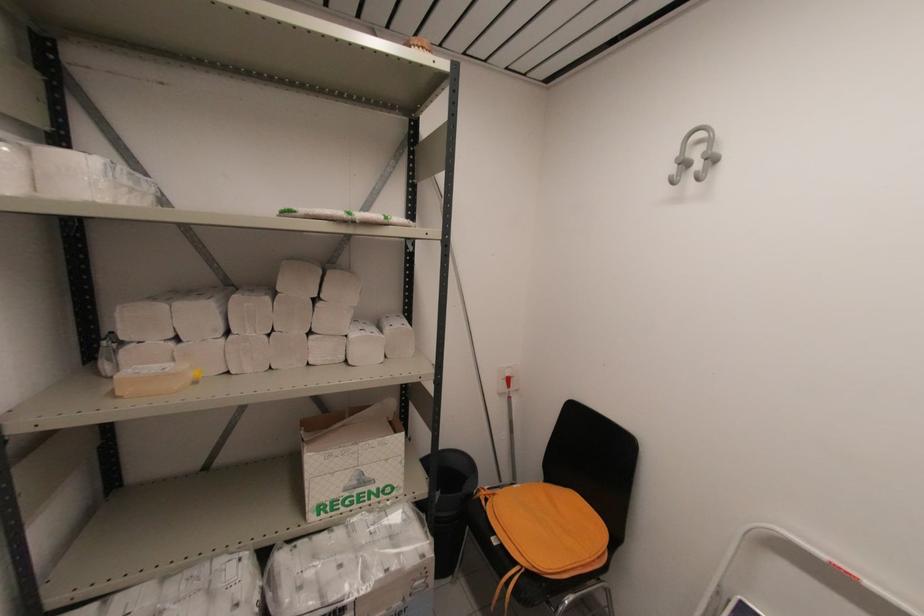
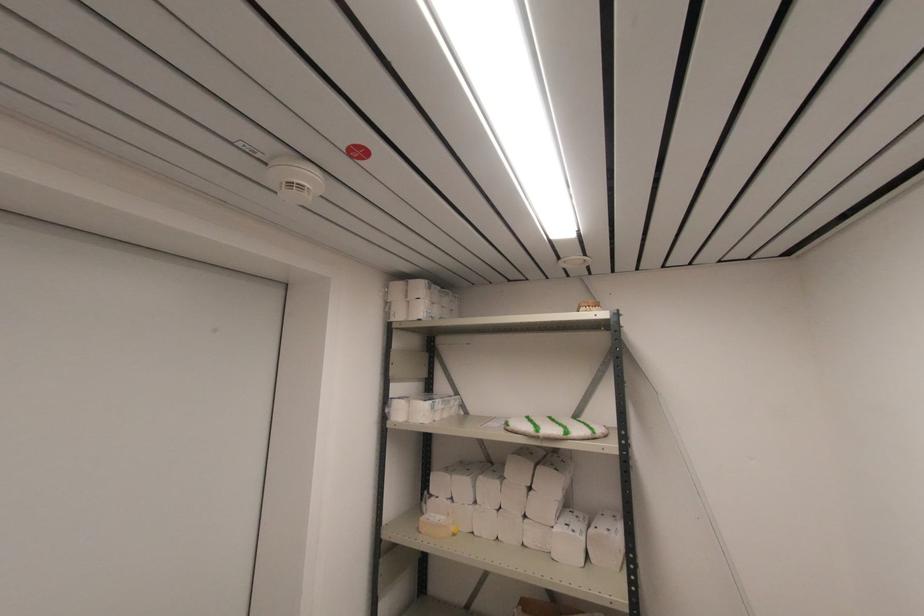
The point at (120, 398) is marked in the first image. Where is the corresponding point in the second image?

(420, 533)